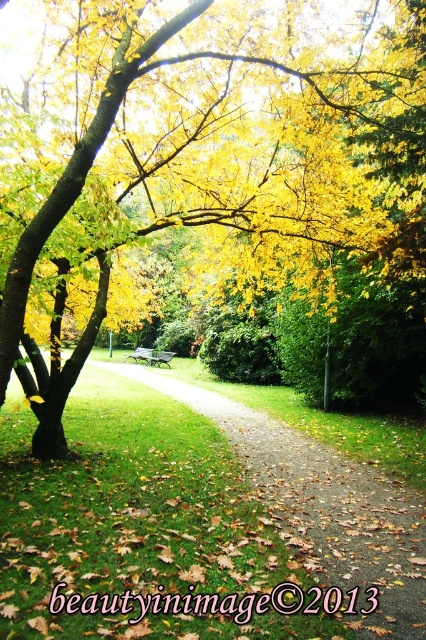
Is yellow leafy tree at upper left above wooden park bench at center?

Correct, yellow leafy tree at upper left is located above wooden park bench at center.

Is yellow leafy tree at upper left thinner than wooden park bench at center?

Incorrect, yellow leafy tree at upper left's width is not less than wooden park bench at center's.

This screenshot has height=640, width=426. I want to click on yellow leafy tree at upper left, so click(258, 173).

The image size is (426, 640). Find the location of `yellow leafy tree at upper left`. yellow leafy tree at upper left is located at coordinates (258, 173).

Is yellow leafy tree at upper left further to the viewer compared to green wooden bench at center?

No, yellow leafy tree at upper left is in front of green wooden bench at center.

Is point (216, 100) positioned before point (155, 362)?

Yes, point (216, 100) is closer to viewer.

Is point (405, 220) positioned in front of point (134, 355)?

Yes, it is.

Locate an element on the screen. The width and height of the screenshot is (426, 640). yellow leafy tree at upper left is located at coordinates (258, 173).

The width and height of the screenshot is (426, 640). Describe the element at coordinates (322, 502) in the screenshot. I see `brown gravel path at center` at that location.

Is the position of brown gravel path at center more distant than that of wooden park bench at center?

No, it is not.

Between point (377, 548) and point (157, 362), which one is positioned in front?

Positioned in front is point (377, 548).

I want to click on brown gravel path at center, so click(x=322, y=502).